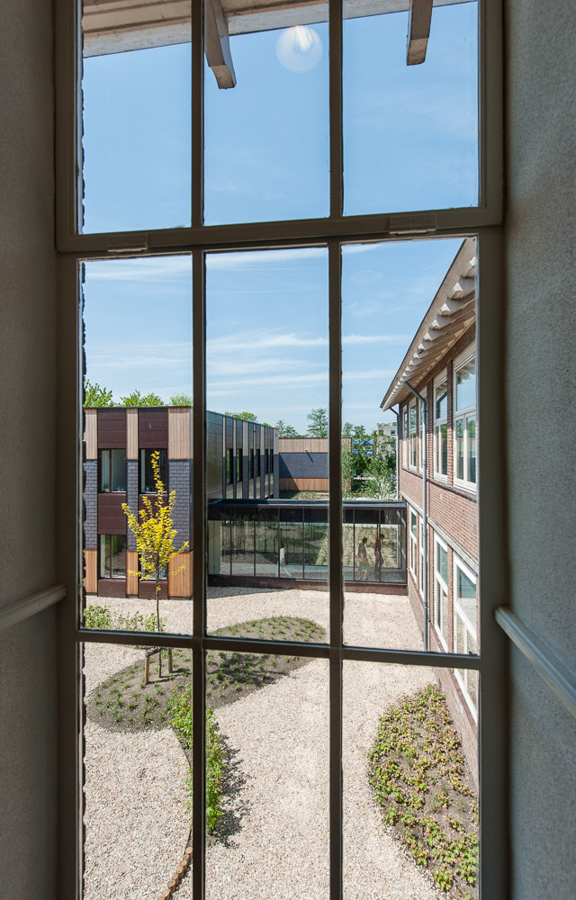
At what (x,y) coordinates should I click in order to perform the action: click on large glass windows. Please return your answer as a coordinate pair (x, y). The image size is (576, 900). Looking at the image, I should click on (269, 573), (318, 576).